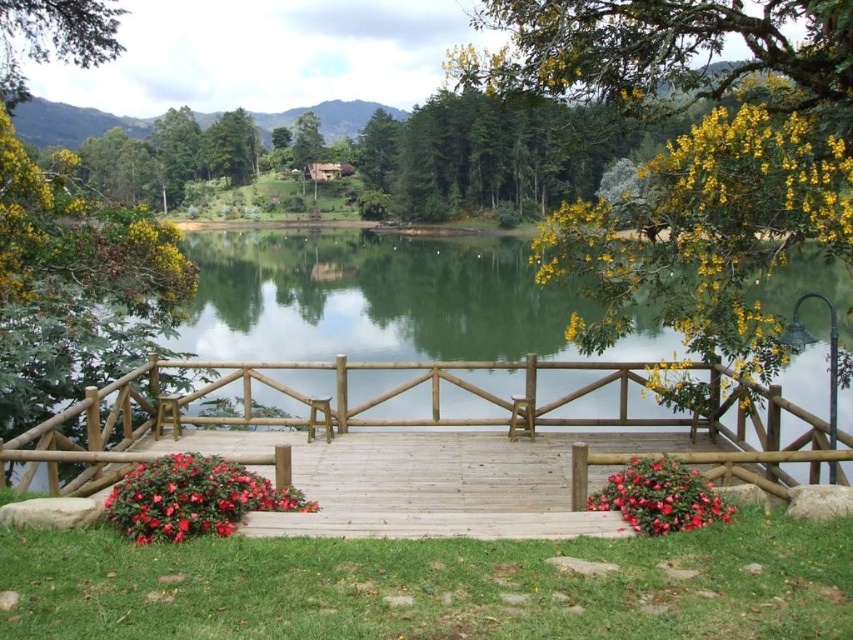
Does yellow-green foliage at upper right have a smaller size compared to yellow matte flower at upper right?

Actually, yellow-green foliage at upper right might be larger than yellow matte flower at upper right.

Between yellow-green foliage at upper right and yellow matte flower at upper right, which one appears on the right side from the viewer's perspective?

yellow-green foliage at upper right is more to the right.

Does point (741, 20) lie in front of point (573, 320)?

That is True.

Find the location of a particular element. The image size is (853, 640). yellow-green foliage at upper right is located at coordinates (689, 154).

Is yellow leafy tree at upper left smaller than red matte flower at lower right?

No.

The height and width of the screenshot is (640, 853). What do you see at coordinates (53, 36) in the screenshot?
I see `yellow leafy tree at upper left` at bounding box center [53, 36].

Image resolution: width=853 pixels, height=640 pixels. I want to click on yellow leafy tree at upper left, so click(53, 36).

Can you confirm if yellow-green foliage at upper right is positioned to the left of wooden deck at center?

No, yellow-green foliage at upper right is not to the left of wooden deck at center.

Is yellow-green foliage at upper right positioned in front of wooden deck at center?

That is True.

Image resolution: width=853 pixels, height=640 pixels. I want to click on yellow-green foliage at upper right, so click(x=689, y=154).